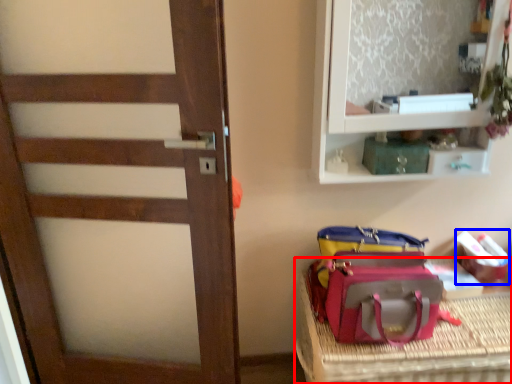
Question: Which point is closer to the camera, furniture (highlighted by a red box) or kit (highlighted by a blue box)?

Choices:
 (A) furniture
 (B) kit

Answer: (A)